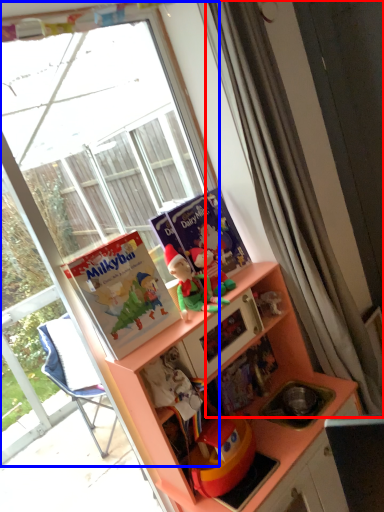
Question: Which point is further to the camera, curtain (highlighted by a red box) or window (highlighted by a blue box)?

Choices:
 (A) curtain
 (B) window

Answer: (A)